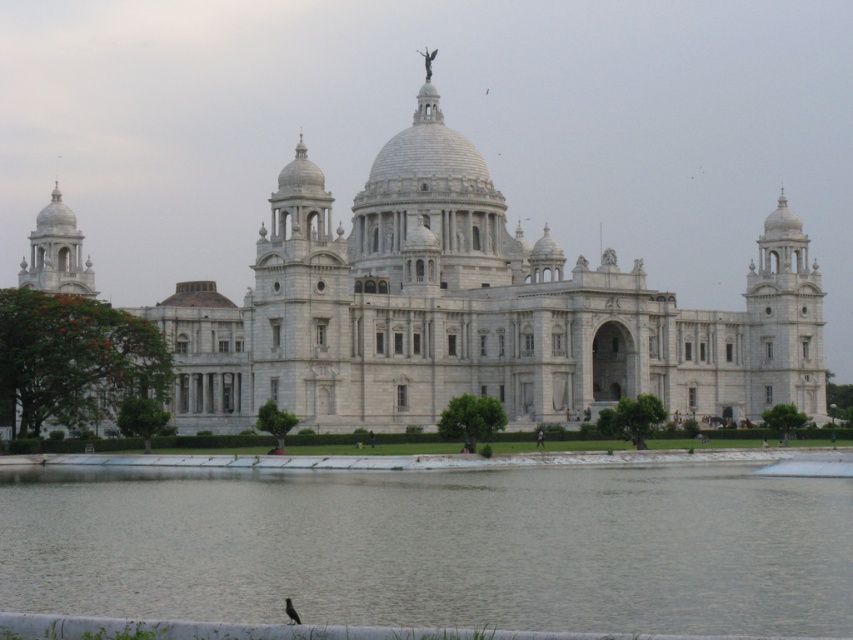
Question: Considering the real-world distances, which object is farthest from the white marble palace at center?

Choices:
 (A) gray concrete water at center
 (B) brown feathered bird at lower center

Answer: (B)

Question: Can you confirm if white marble palace at center is positioned below brown feathered bird at lower center?

Choices:
 (A) yes
 (B) no

Answer: (B)

Question: Does white marble palace at center have a larger size compared to brown feathered bird at lower center?

Choices:
 (A) no
 (B) yes

Answer: (B)

Question: Which object is farther from the camera taking this photo?

Choices:
 (A) brown feathered bird at lower center
 (B) gray concrete water at center
 (C) white marble palace at center

Answer: (C)

Question: Is gray concrete water at center bigger than white marble palace at center?

Choices:
 (A) yes
 (B) no

Answer: (B)

Question: Which object appears closest to the camera in this image?

Choices:
 (A) gray concrete water at center
 (B) white marble palace at center
 (C) brown feathered bird at lower center

Answer: (C)